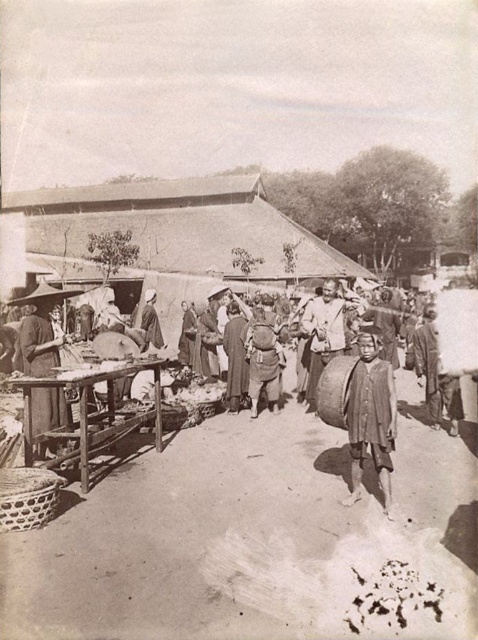
You are a photographer in the market and want to take a photo of the brown fabric child at center. Where should you stand to capture it in the frame?

The brown fabric child at center is located at coordinates point (370,417), so you should position yourself facing that point to include it in your photo.

You are a visitor at this historical market scene. You see the smooth wooden table at left and the smooth brown hat at center. Which object is closer to you?

The smooth wooden table at left is closer to you because it is in front of the smooth brown hat at center.